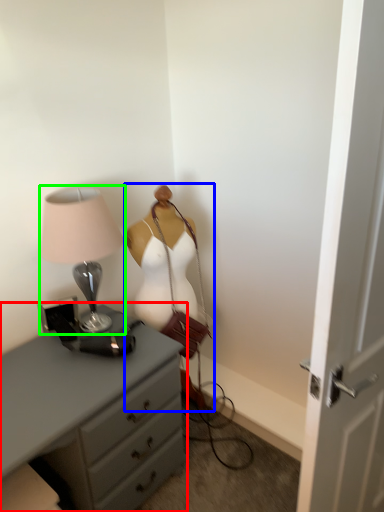
Question: Which object is positioned farthest from chest of drawers (highlighted by a red box)? Select from mannequin (highlighted by a blue box) and lamp (highlighted by a green box).

Choices:
 (A) mannequin
 (B) lamp

Answer: (A)